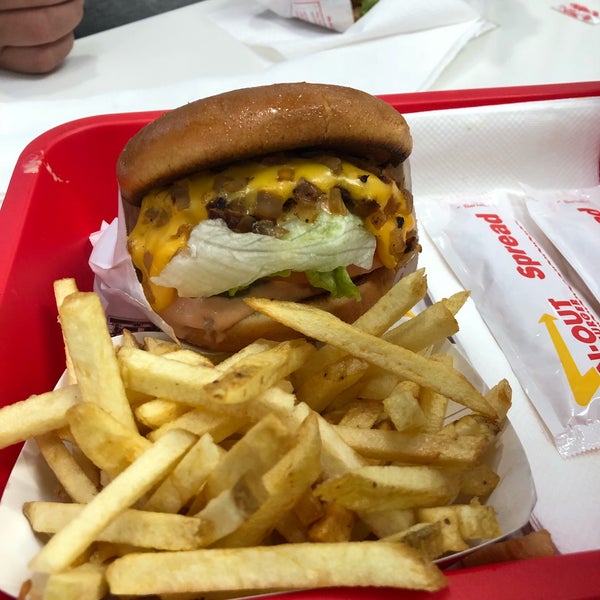
You are a GUI agent. You are given a task and a screenshot of the screen. Output one action in this format:
    pyautogui.click(x=<x>, y=<y>)
    Task: Click on the napkin
    
    Given the screenshot: What is the action you would take?
    pyautogui.click(x=556, y=513)